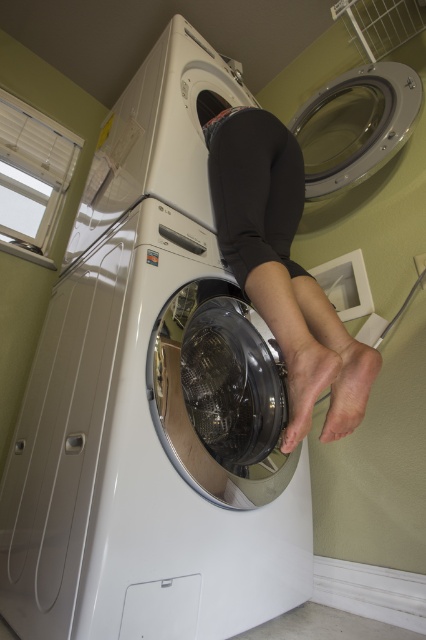
Based on the photo, does pink smooth foot at lower right appear over matte black foot at lower center?

Answer: Yes.

Does pink smooth foot at lower right have a smaller size compared to matte black foot at lower center?

No.

The height and width of the screenshot is (640, 426). What are the coordinates of `pink smooth foot at lower right` in the screenshot? It's located at (348, 381).

Is white glossy washing machine at center wider than transparent glass door at center?

Yes, white glossy washing machine at center is wider than transparent glass door at center.

Is point (137, 529) less distant than point (365, 166)?

Yes, point (137, 529) is closer to viewer.

Identify the location of white glossy washing machine at center. The height and width of the screenshot is (640, 426). (140, 461).

Who is shorter, transparent glass door at center or matte black foot at lower center?

With less height is matte black foot at lower center.

Describe the element at coordinates (356, 124) in the screenshot. The width and height of the screenshot is (426, 640). I see `transparent glass door at center` at that location.

The width and height of the screenshot is (426, 640). I want to click on transparent glass door at center, so click(356, 124).